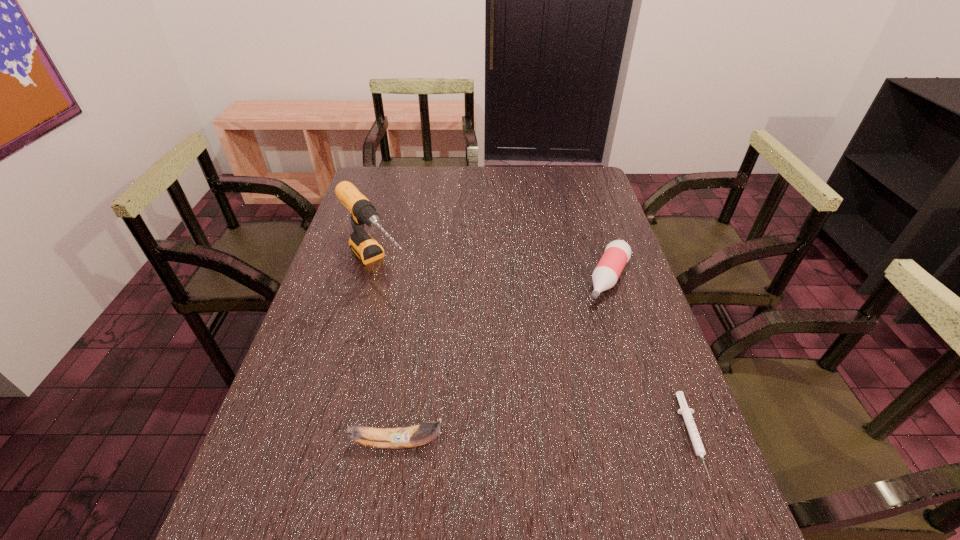
Find the location of a particular element. The height and width of the screenshot is (540, 960). free space that is in between the syringe and the tallest object is located at coordinates (535, 350).

Where is `empty space that is in between the second shortest object and the drill`? empty space that is in between the second shortest object and the drill is located at coordinates (492, 272).

This screenshot has height=540, width=960. I want to click on vacant area that lies between the shortest object and the drill, so click(x=535, y=350).

Identify the location of object that ranks as the closest to the drill. The height and width of the screenshot is (540, 960). (401, 437).

Find the location of a particular element. Image resolution: width=960 pixels, height=540 pixels. object that is the closest to the banana is located at coordinates (366, 248).